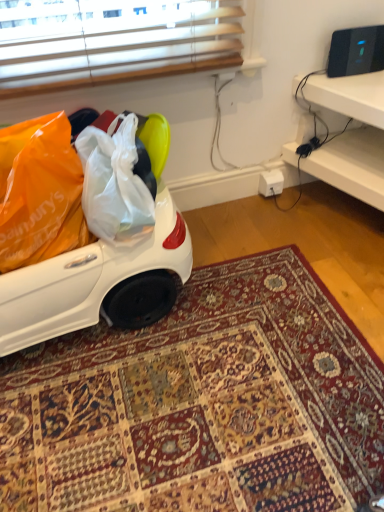
Question: From a real-world perspective, is carpeted rug at center above or below white plastic desk at right?

Choices:
 (A) above
 (B) below

Answer: (B)

Question: Is carpeted rug at center taller or shorter than white plastic desk at right?

Choices:
 (A) short
 (B) tall

Answer: (A)

Question: Is carpeted rug at center wider or thinner than white plastic desk at right?

Choices:
 (A) thin
 (B) wide

Answer: (B)

Question: In terms of height, does white plastic desk at right look taller or shorter compared to carpeted rug at center?

Choices:
 (A) tall
 (B) short

Answer: (A)

Question: Relative to carpeted rug at center, is white plastic desk at right in front or behind?

Choices:
 (A) behind
 (B) front

Answer: (A)

Question: From a real-world perspective, relative to carpeted rug at center, is white plastic desk at right vertically above or below?

Choices:
 (A) above
 (B) below

Answer: (A)

Question: In terms of width, does white plastic desk at right look wider or thinner when compared to carpeted rug at center?

Choices:
 (A) thin
 (B) wide

Answer: (A)